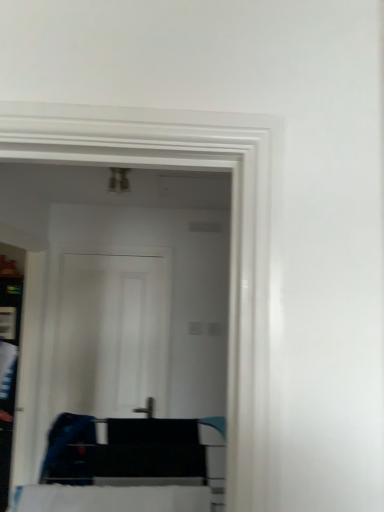
This screenshot has height=512, width=384. What do you see at coordinates (133, 453) in the screenshot? I see `black fabric chair at lower center` at bounding box center [133, 453].

Measure the distance between black fabric chair at lower center and camera.

black fabric chair at lower center and camera are 35.06 inches apart.

Locate an element on the screen. The width and height of the screenshot is (384, 512). black fabric chair at lower center is located at coordinates (133, 453).

The width and height of the screenshot is (384, 512). In order to click on black fabric chair at lower center in this screenshot , I will do `click(133, 453)`.